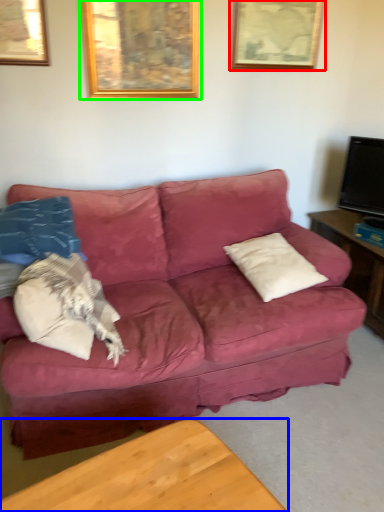
Question: Which object is positioned farthest from picture frame (highlighted by a red box)? Select from table (highlighted by a blue box) and picture frame (highlighted by a green box).

Choices:
 (A) table
 (B) picture frame

Answer: (A)